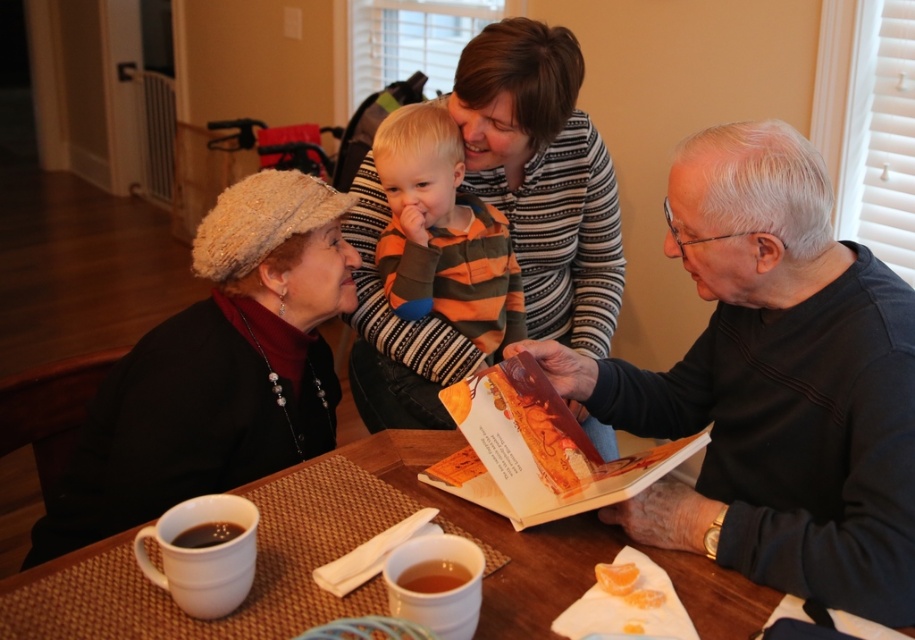
Does orange paper book at center appear on the left side of black matte mug at lower left?

Incorrect, orange paper book at center is not on the left side of black matte mug at lower left.

Is orange paper book at center below black matte mug at lower left?

Actually, orange paper book at center is above black matte mug at lower left.

Who is more distant from viewer, (508,387) or (225,529)?

The point (508,387) is more distant.

In order to click on orange paper book at center in this screenshot , I will do `click(536, 449)`.

Between matte black jacket at lower left and black matte mug at lower left, which one has less height?

With less height is black matte mug at lower left.

Can you confirm if matte black jacket at lower left is smaller than black matte mug at lower left?

No, matte black jacket at lower left is not smaller than black matte mug at lower left.

Between point (298, 346) and point (222, 532), which one is positioned behind?

The point (298, 346) is more distant.

I want to click on matte black jacket at lower left, so click(x=218, y=369).

Who is more forward, (x=797, y=308) or (x=410, y=496)?

Point (x=797, y=308)

The height and width of the screenshot is (640, 915). What are the coordinates of `black matte book at center` in the screenshot? It's located at (774, 384).